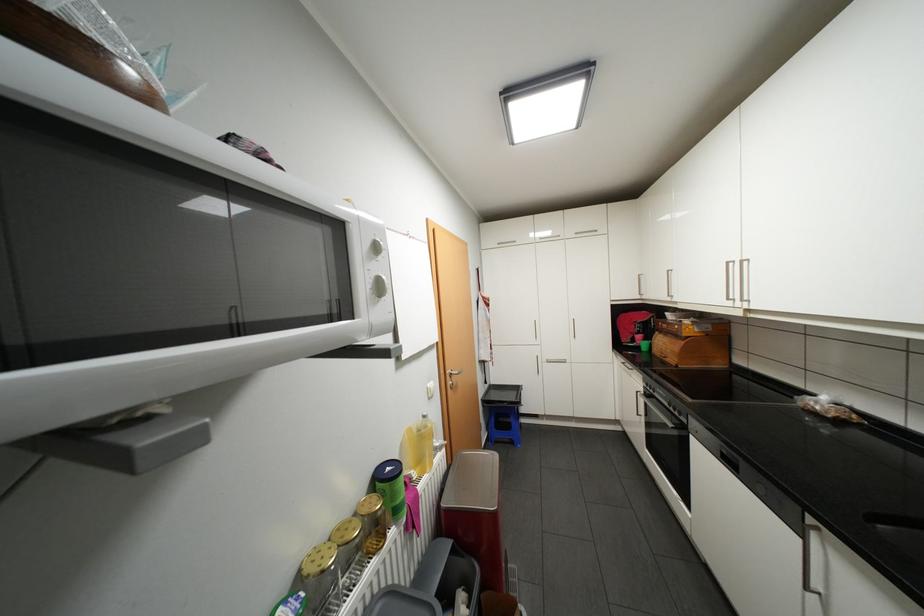
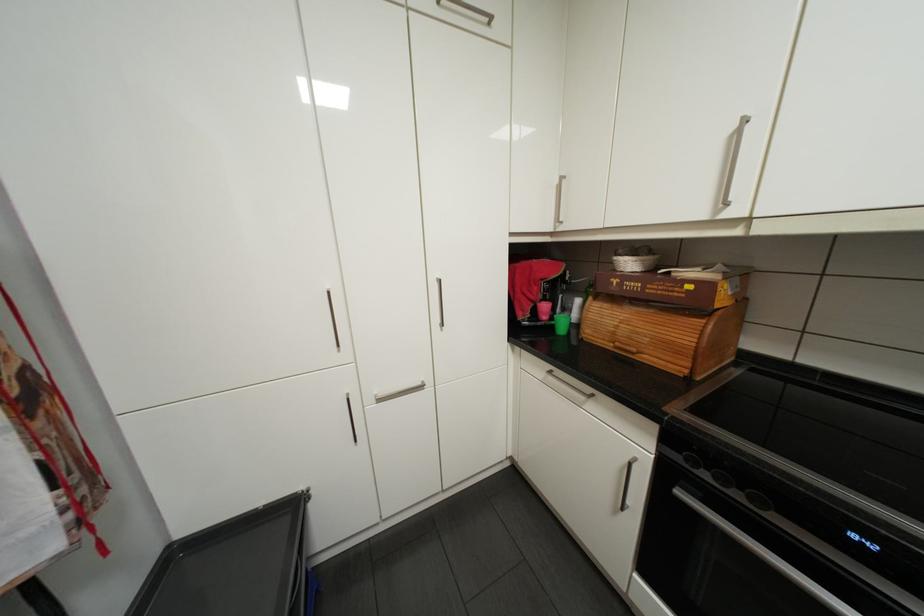
Find the pixel in the second image that matches [667,331] in the first image.

(602, 297)